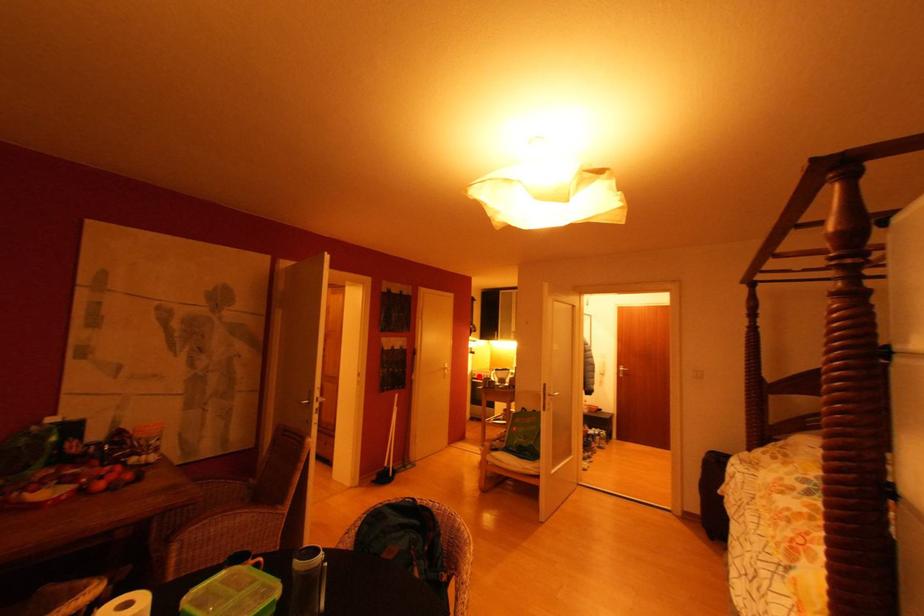
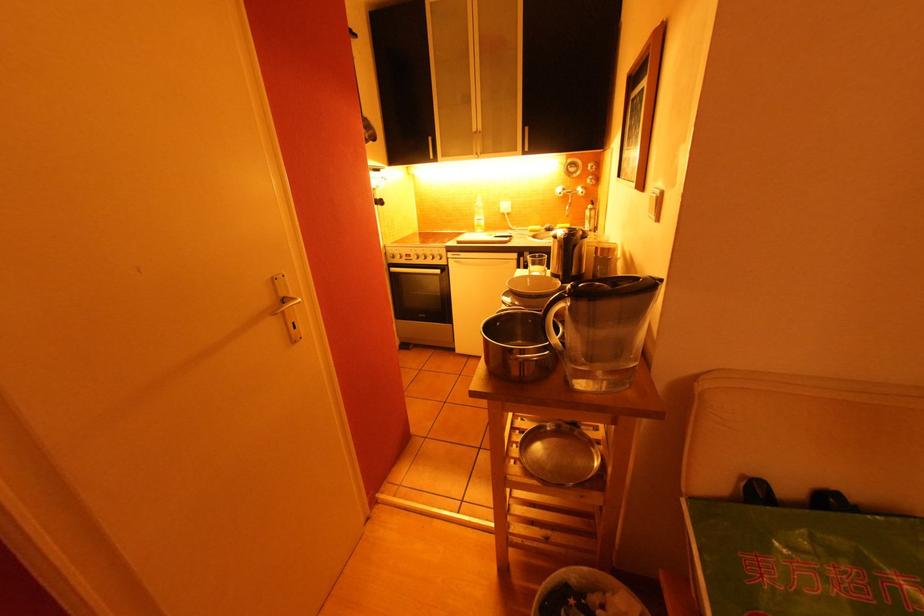
Where in the second image is the point corresponding to the highlighted location from the first image?

(398, 259)